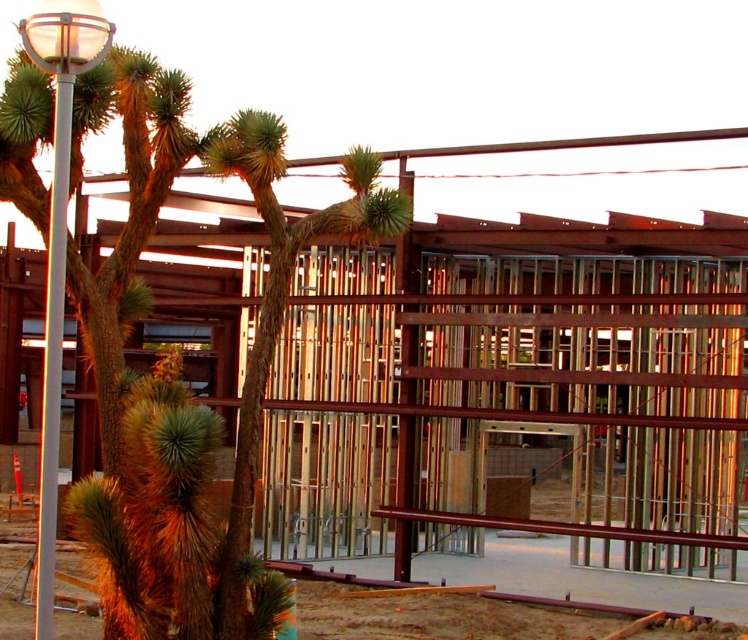
From the picture: Can you confirm if green spiky palm tree at center is positioned to the right of white glossy lamp post at left?

Indeed, green spiky palm tree at center is positioned on the right side of white glossy lamp post at left.

Find the location of a particular element. The height and width of the screenshot is (640, 748). green spiky palm tree at center is located at coordinates point(278,305).

Image resolution: width=748 pixels, height=640 pixels. Find the location of `green spiky palm tree at center`. green spiky palm tree at center is located at coordinates (278, 305).

Can you confirm if white glossy lamp post at left is shorter than white glossy pole at left?

Incorrect, white glossy lamp post at left's height does not fall short of white glossy pole at left's.

Does white glossy lamp post at left lie in front of white glossy pole at left?

That is False.

This screenshot has width=748, height=640. I want to click on white glossy lamp post at left, so click(58, 240).

Does green spiky palm tree at center appear on the right side of white glossy pole at left?

Correct, you'll find green spiky palm tree at center to the right of white glossy pole at left.

Can you confirm if green spiky palm tree at center is smaller than white glossy pole at left?

No.

You are a GUI agent. You are given a task and a screenshot of the screen. Output one action in this format:
    pyautogui.click(x=<x>, y=<y>)
    Task: Click on the green spiky palm tree at center
    
    Given the screenshot: What is the action you would take?
    pyautogui.click(x=278, y=305)

Locate an element on the screen. This screenshot has height=640, width=748. green spiky palm tree at center is located at coordinates (278, 305).